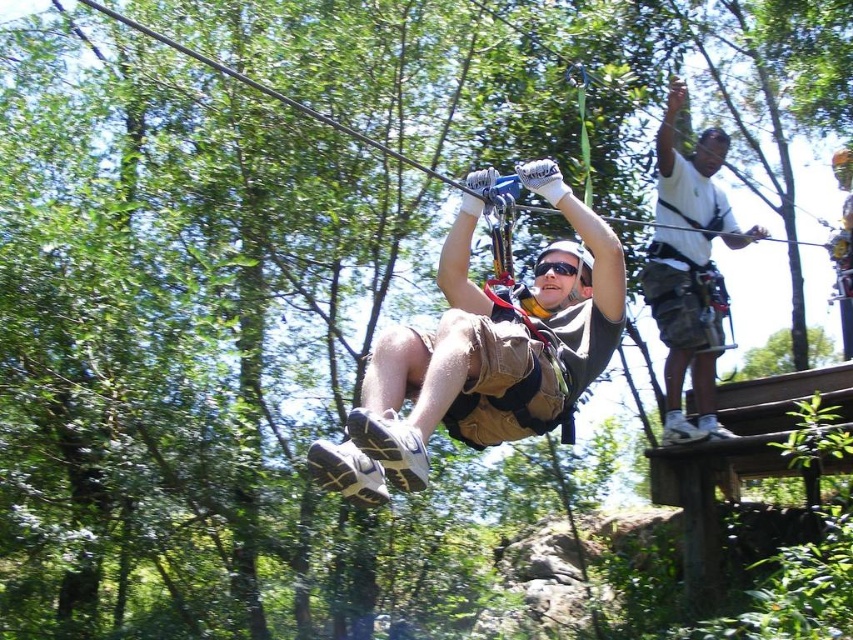
Based on the photo, who is positioned more to the left, tan fabric shorts at center or white cotton shirt at upper right?

From the viewer's perspective, tan fabric shorts at center appears more on the left side.

Where is `tan fabric shorts at center`? The width and height of the screenshot is (853, 640). tan fabric shorts at center is located at coordinates (483, 355).

Is point (573, 244) positioned behind point (695, 188)?

No, (573, 244) is in front of (695, 188).

Locate an element on the screen. This screenshot has height=640, width=853. tan fabric shorts at center is located at coordinates [483, 355].

Does white cotton shirt at upper right appear under black matte goggles at center?

Incorrect, white cotton shirt at upper right is not positioned below black matte goggles at center.

Does white cotton shirt at upper right come in front of black matte goggles at center?

No.

Is point (674, 339) less distant than point (577, 266)?

That is False.

Image resolution: width=853 pixels, height=640 pixels. In order to click on white cotton shirt at upper right in this screenshot , I will do `click(689, 269)`.

Can you confirm if tan fabric shorts at center is taller than black matte goggles at center?

Yes, tan fabric shorts at center is taller than black matte goggles at center.

Does tan fabric shorts at center have a smaller size compared to black matte goggles at center?

Actually, tan fabric shorts at center might be larger than black matte goggles at center.

Which is in front, point (492, 433) or point (538, 273)?

Positioned in front is point (492, 433).

You are a GUI agent. You are given a task and a screenshot of the screen. Output one action in this format:
    pyautogui.click(x=<x>, y=<y>)
    Task: Click on the tan fabric shorts at center
    
    Given the screenshot: What is the action you would take?
    pyautogui.click(x=483, y=355)